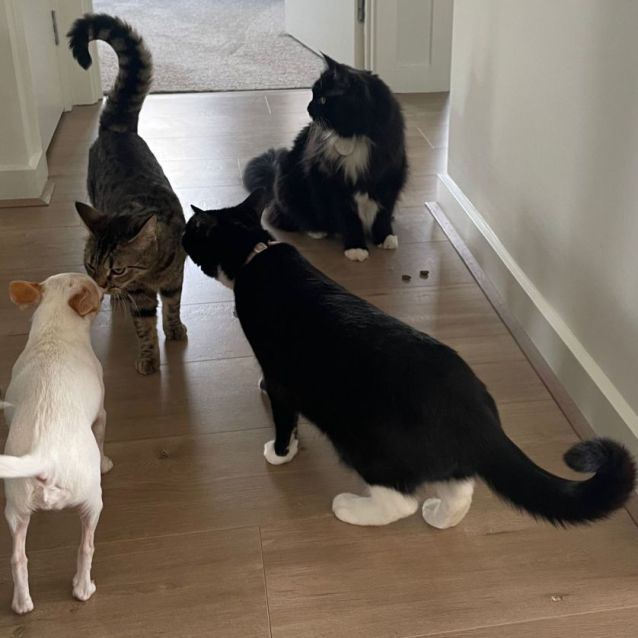
The height and width of the screenshot is (638, 638). Find the location of `walls`. walls is located at coordinates (563, 167), (10, 70).